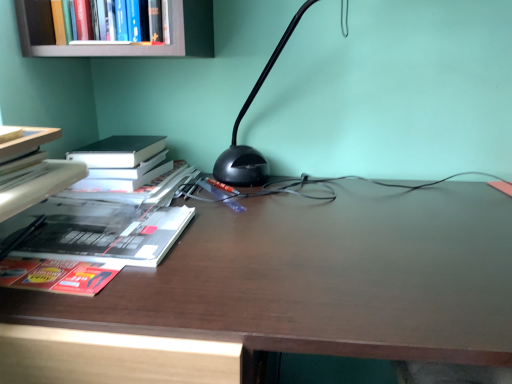
Question: Considering the relative positions of hardcover book at left, placed as the first book when sorted from bottom to top, and white paper at left, placed as the second book when sorted from top to bottom, in the image provided, is hardcover book at left, placed as the first book when sorted from bottom to top, to the left or to the right of white paper at left, placed as the second book when sorted from top to bottom,?

Choices:
 (A) left
 (B) right

Answer: (B)

Question: Considering the positions of hardcover book at left, placed as the first book when sorted from bottom to top, and white paper at left, placed as the second book when sorted from top to bottom, in the image, is hardcover book at left, placed as the first book when sorted from bottom to top, taller or shorter than white paper at left, placed as the second book when sorted from top to bottom,?

Choices:
 (A) short
 (B) tall

Answer: (A)

Question: Based on their relative distances, which object is farther from the white paper at left, placed as the second book when sorted from top to bottom?

Choices:
 (A) hardcover book at upper left, the first book from the top
 (B) black plastic lamp at center
 (C) dark wood desk at center
 (D) hardcover book at left, placed as the first book when sorted from bottom to top

Answer: (C)

Question: Which of these objects is positioned closest to the hardcover book at left, acting as the 3th book starting from the top?

Choices:
 (A) black plastic lamp at center
 (B) hardcover book at upper left, the first book from the top
 (C) white paper at left, placed as the second book when sorted from top to bottom
 (D) dark wood desk at center

Answer: (C)